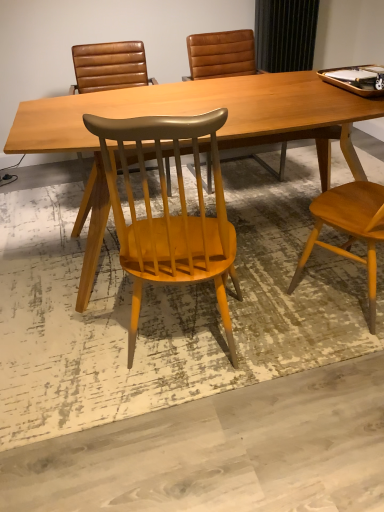
Question: In which direction should I rotate to look at matte brown leather chair at center, which is the third chair in front-to-back order?

Choices:
 (A) right
 (B) left

Answer: (A)

Question: Does matte brown leather chair at center, the 1th chair when ordered from back to front, contain light brown wood desk at center?

Choices:
 (A) yes
 (B) no

Answer: (B)

Question: Considering the relative sizes of matte brown leather chair at center, which is the third chair in front-to-back order, and light brown wood desk at center in the image provided, is matte brown leather chair at center, which is the third chair in front-to-back order, bigger than light brown wood desk at center?

Choices:
 (A) no
 (B) yes

Answer: (A)

Question: Is matte brown leather chair at center, which is the third chair in front-to-back order, shorter than light brown wood desk at center?

Choices:
 (A) no
 (B) yes

Answer: (A)

Question: Could you tell me if matte brown leather chair at center, the 1th chair when ordered from back to front, is turned towards light brown wood desk at center?

Choices:
 (A) yes
 (B) no

Answer: (A)

Question: From the image's perspective, does matte brown leather chair at center, the 1th chair when ordered from back to front, appear lower than light brown wood desk at center?

Choices:
 (A) no
 (B) yes

Answer: (A)

Question: From a real-world perspective, does matte brown leather chair at center, which is the third chair in front-to-back order, stand above light brown wood desk at center?

Choices:
 (A) no
 (B) yes

Answer: (B)

Question: Is matte brown leather chair at center, the 1th chair when ordered from back to front, at the right side of brown leather chair at upper center, which appears as the second chair when viewed from the front?

Choices:
 (A) yes
 (B) no

Answer: (A)

Question: Is brown leather chair at upper center, which appears as the second chair when viewed from the front, at the back of matte brown leather chair at center, which is the third chair in front-to-back order?

Choices:
 (A) yes
 (B) no

Answer: (B)

Question: Can you confirm if matte brown leather chair at center, the 1th chair when ordered from back to front, is smaller than brown leather chair at upper center, which appears as the second chair when viewed from the front?

Choices:
 (A) no
 (B) yes

Answer: (A)

Question: From the image's perspective, is matte brown leather chair at center, which is the third chair in front-to-back order, located above brown leather chair at upper center, which appears as the second chair when viewed from the front?

Choices:
 (A) no
 (B) yes

Answer: (B)

Question: Can you confirm if matte brown leather chair at center, the 1th chair when ordered from back to front, is thinner than brown leather chair at upper center, which is the second chair from back to front?

Choices:
 (A) yes
 (B) no

Answer: (B)

Question: Is matte brown leather chair at center, which is the third chair in front-to-back order, oriented towards brown leather chair at upper center, which appears as the second chair when viewed from the front?

Choices:
 (A) no
 (B) yes

Answer: (A)

Question: Would you say light brown wood desk at center contains brown leather chair at upper center, which is the second chair from back to front?

Choices:
 (A) no
 (B) yes

Answer: (A)